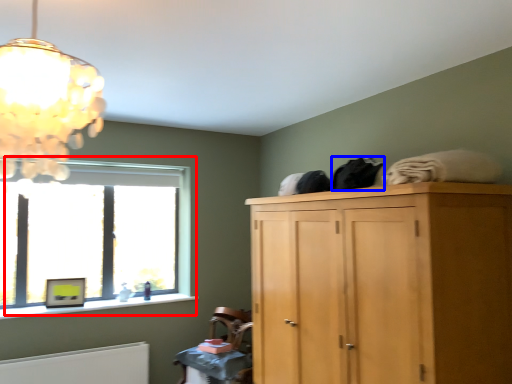
Question: Which object is closer to the camera taking this photo, window (highlighted by a red box) or clothing (highlighted by a blue box)?

Choices:
 (A) window
 (B) clothing

Answer: (B)